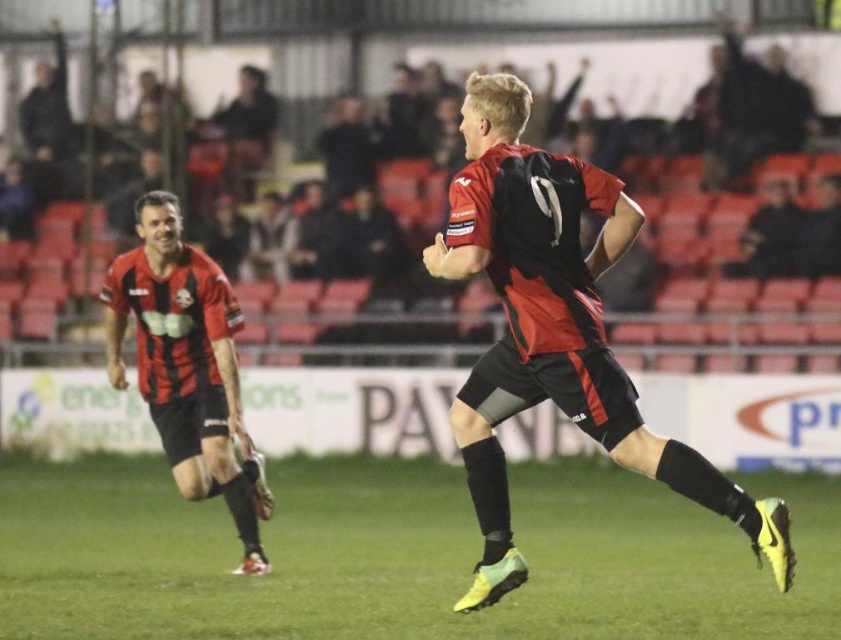
Between point (527, 296) and point (188, 273), which one is positioned behind?

Positioned behind is point (188, 273).

Can you confirm if matte black jersey at center is taller than matte black jersey at left?

In fact, matte black jersey at center may be shorter than matte black jersey at left.

The image size is (841, 640). What do you see at coordinates (554, 330) in the screenshot?
I see `matte black jersey at center` at bounding box center [554, 330].

Identify the location of matte black jersey at center. This screenshot has height=640, width=841. (554, 330).

Can you confirm if yellow synthetic turf at center is bigger than matte black jersey at left?

Yes.

Which of these two, yellow synthetic turf at center or matte black jersey at left, stands shorter?

yellow synthetic turf at center

Who is more distant from viewer, [738,634] or [176,330]?

The point [176,330] is behind.

Locate an element on the screen. This screenshot has width=841, height=640. yellow synthetic turf at center is located at coordinates (399, 556).

Does point (88, 492) come in front of point (561, 259)?

That is False.

Is yellow synthetic turf at center taller than matte black jersey at center?

In fact, yellow synthetic turf at center may be shorter than matte black jersey at center.

Is point (410, 513) behind point (535, 227)?

Yes, point (410, 513) is farther from viewer.

At what (x,y) coordinates should I click in order to perform the action: click on yellow synthetic turf at center. Please return your answer as a coordinate pair (x, y). The height and width of the screenshot is (640, 841). Looking at the image, I should click on (399, 556).